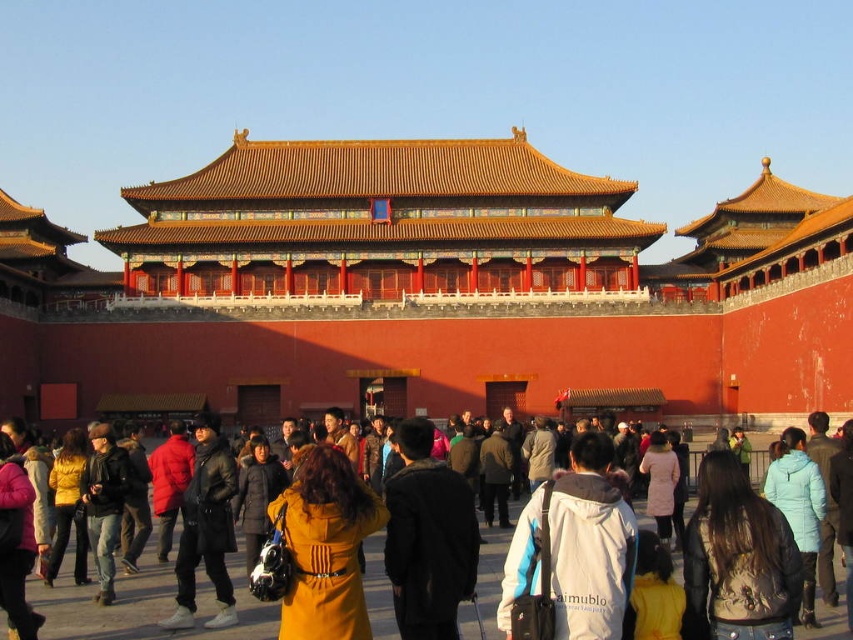
Question: Which object is the farthest from the brown leather jacket at lower right?

Choices:
 (A) light blue fabric coat at lower right
 (B) dark brown leather jacket at center

Answer: (B)

Question: Does white fleece jacket at center appear on the right side of yellow matte coat at lower left?

Choices:
 (A) yes
 (B) no

Answer: (A)

Question: Is yellow matte coat at lower left further to the viewer compared to pink wool coat at center?

Choices:
 (A) yes
 (B) no

Answer: (B)

Question: Which is nearer to the yellow matte coat at lower left?

Choices:
 (A) dark brown coat at center
 (B) brown leather jacket at lower right
 (C) red painted wood palace at center

Answer: (A)

Question: Which object is closer to the camera taking this photo?

Choices:
 (A) dark gray fabric coat at center
 (B) dark brown leather jacket at center

Answer: (B)

Question: Can you confirm if dark brown leather jacket at center is smaller than brown leather jacket at lower right?

Choices:
 (A) yes
 (B) no

Answer: (B)